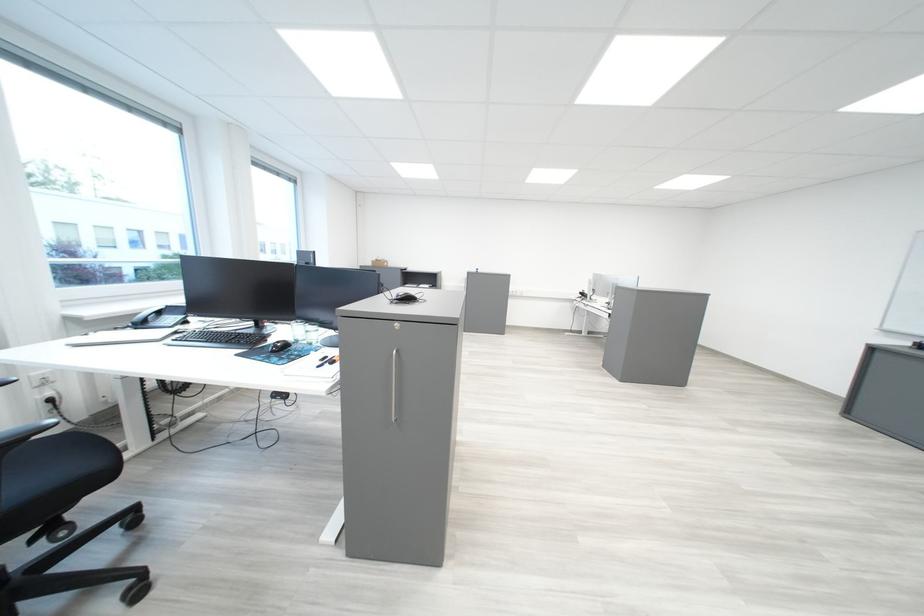
Where would you lift the clear drinking glass? Please return your answer as a coordinate pair (x, y).

(311, 333)